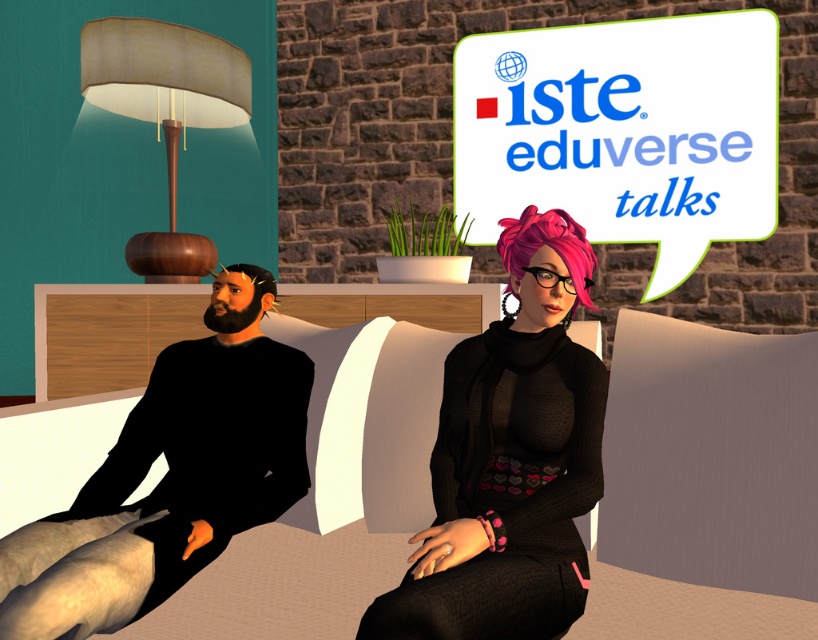
Between point (403, 608) and point (66, 419), which one is positioned in front?

Point (403, 608) is in front.

Between point (524, 538) and point (79, 445), which one is positioned behind?

The point (79, 445) is more distant.

Is point (488, 636) closer to viewer compared to point (776, 605)?

Yes, point (488, 636) is in front of point (776, 605).

The image size is (818, 640). What are the coordinates of `shiny pink hair at center` in the screenshot? It's located at 510,460.

Can you confirm if black matte clothing at left is positioned to the right of matte brown lampshade at upper left?

Correct, you'll find black matte clothing at left to the right of matte brown lampshade at upper left.

How far apart are black matte clothing at left and matte brown lampshade at upper left?

A distance of 8.00 feet exists between black matte clothing at left and matte brown lampshade at upper left.

Find the location of a particular element. black matte clothing at left is located at coordinates (169, 476).

You are a GUI agent. You are given a task and a screenshot of the screen. Output one action in this format:
    pyautogui.click(x=<x>, y=<y>)
    Task: Click on the black matte clothing at left
    The image size is (818, 640).
    Given the screenshot: What is the action you would take?
    pyautogui.click(x=169, y=476)

Does shiny pink hair at center appear over matte brown lampshade at upper left?

Incorrect, shiny pink hair at center is not positioned above matte brown lampshade at upper left.

What do you see at coordinates (510, 460) in the screenshot?
I see `shiny pink hair at center` at bounding box center [510, 460].

Image resolution: width=818 pixels, height=640 pixels. In order to click on shiny pink hair at center in this screenshot , I will do `click(510, 460)`.